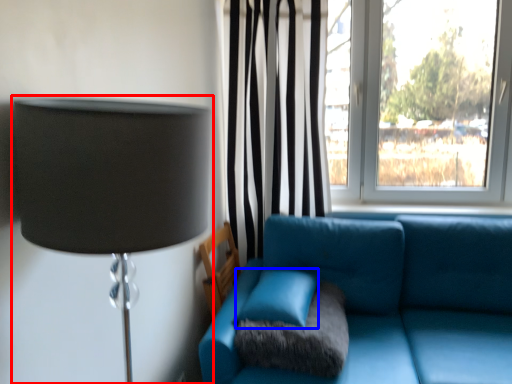
Question: Which object is closer to the camera taking this photo, lamp (highlighted by a red box) or turquoise (highlighted by a blue box)?

Choices:
 (A) lamp
 (B) turquoise

Answer: (A)